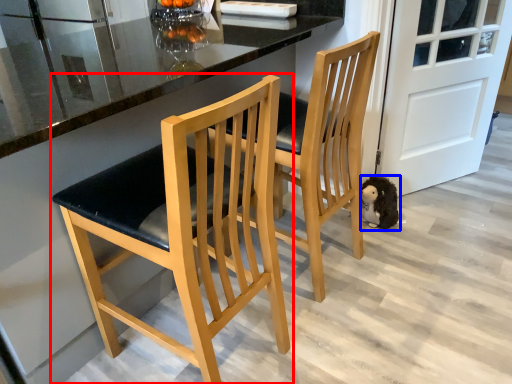
Question: Which of the following is the closest to the observer, chair (highlighted by a red box) or animal (highlighted by a blue box)?

Choices:
 (A) chair
 (B) animal

Answer: (A)